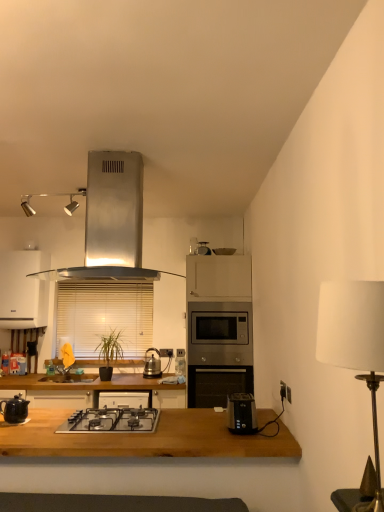
What are the coordinates of `unoccupied region to the right of black plastic toaster at lower center` in the screenshot? It's located at (274, 426).